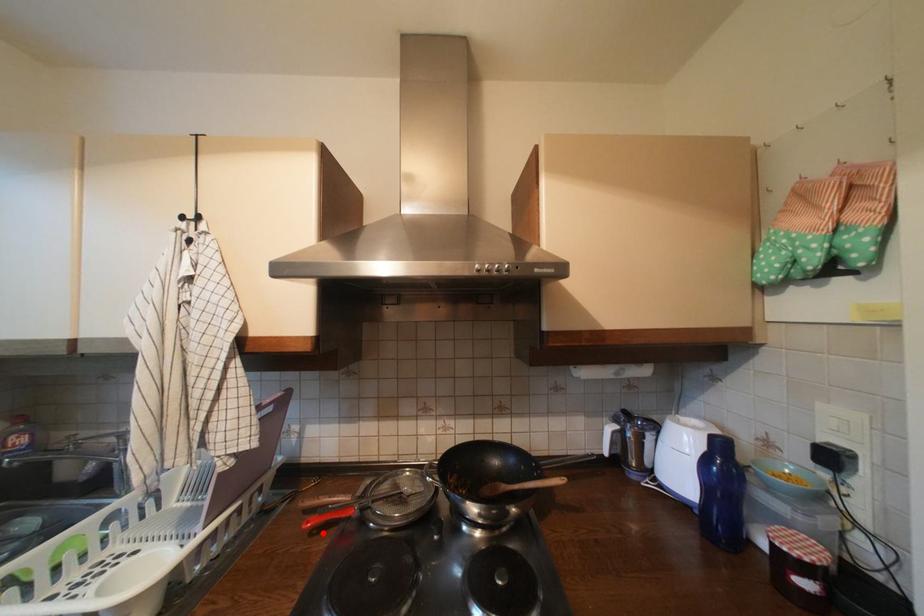
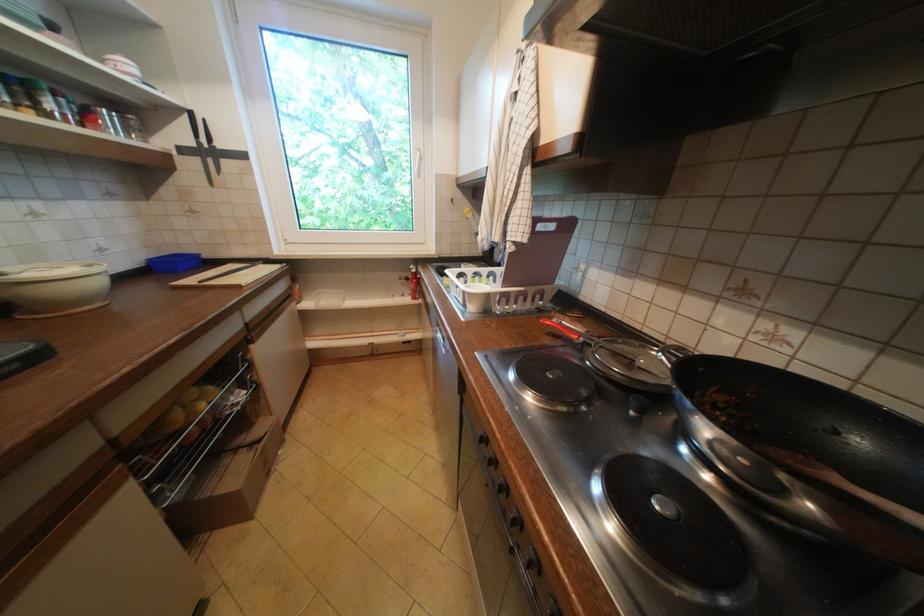
Where in the second image is the point corresponding to the highlighted location from the first image?

(558, 334)